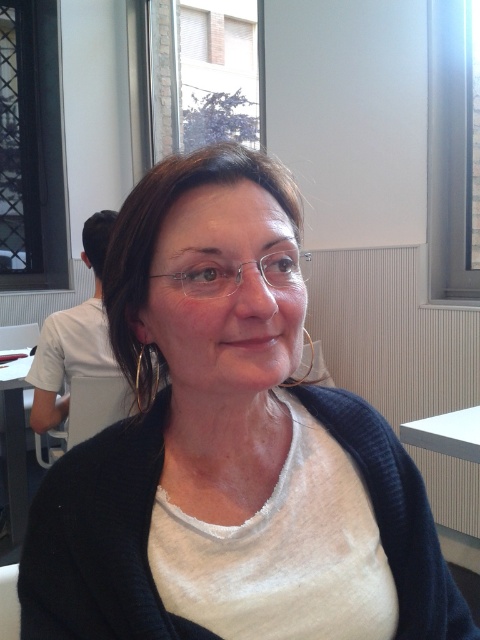
Is matte glass window at upper center to the left of white glossy table at lower left from the viewer's perspective?

No, matte glass window at upper center is not to the left of white glossy table at lower left.

Which is behind, point (252, 147) or point (20, 490)?

The point (252, 147) is more distant.

Find the location of a particular element. matte glass window at upper center is located at coordinates (218, 72).

Does metallic mesh window at upper left have a lesser height compared to white glossy table at lower left?

Incorrect, metallic mesh window at upper left's height does not fall short of white glossy table at lower left's.

Is point (32, 52) closer to viewer compared to point (23, 406)?

No, (32, 52) is behind (23, 406).

Where is `metallic mesh window at upper left`? This screenshot has height=640, width=480. metallic mesh window at upper left is located at coordinates (32, 148).

Is white glossy table at lower left taller than clear plastic glasses at center?

Yes, white glossy table at lower left is taller than clear plastic glasses at center.

Who is more distant from viewer, [17,364] or [273,273]?

The point [17,364] is more distant.

The width and height of the screenshot is (480, 640). What are the coordinates of `white glossy table at lower left` in the screenshot? It's located at (15, 442).